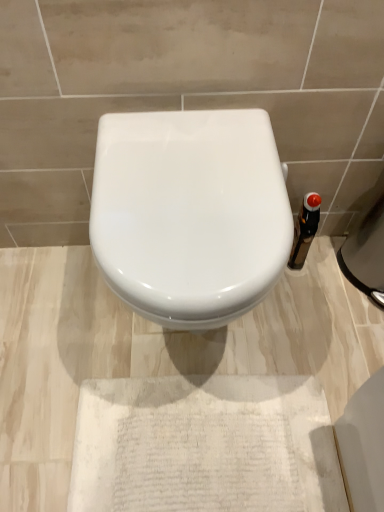
At what (x,y) coordinates should I click in order to perform the action: click on vacant space in white glossy toilet at center (from a real-world perspective). Please return your answer as a coordinate pair (x, y). The height and width of the screenshot is (512, 384). Looking at the image, I should click on (182, 352).